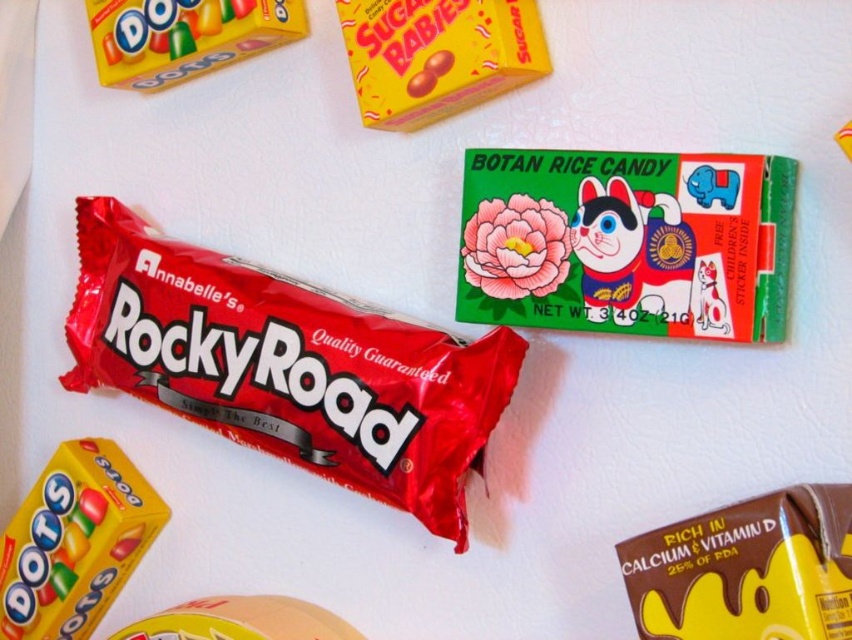
You are organizing a candy display and need to place the green paper botan rice candy at upper center and the yellow matte candy at upper center. Since the display requires the larger candy to be placed at the back for visibility, which candy should be positioned at the back?

The green paper botan rice candy at upper center should be placed at the back because it has a larger size compared to the yellow matte candy at upper center, ensuring better visibility.

You are a child trying to choose between the shiny red chocolate bar at center and the glossy yellow candy at upper left. Which one is wider?

The shiny red chocolate bar at center is wider than the glossy yellow candy at upper left.